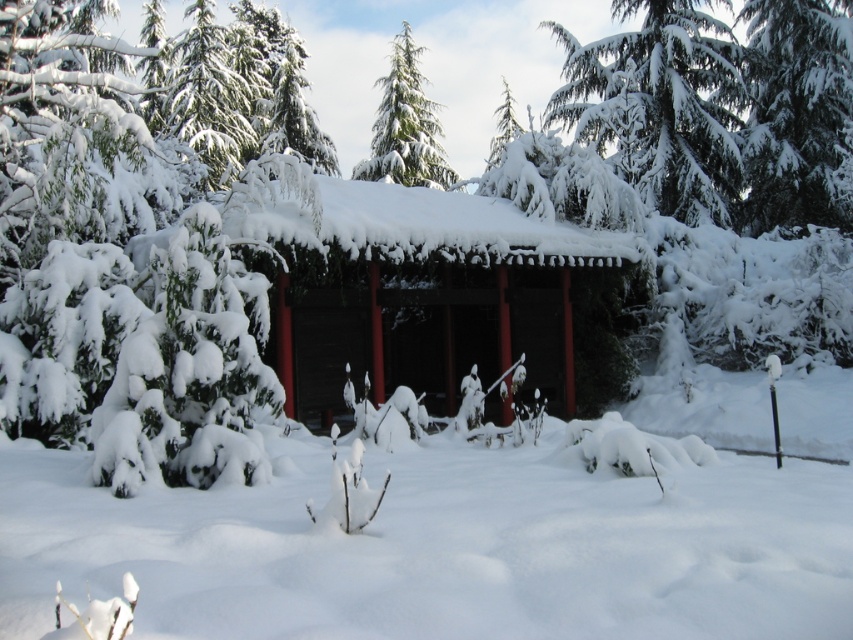
You are standing at the entrance of the pavilion and want to walk towards the point marked at coordinates point [526,568]. However, there is an obstacle at point [563,288]. Based on the spatial relationship between these two points, will you encounter the obstacle before reaching your destination?

Point [526,568] is in front of point [563,288], so you will reach your destination before encountering the obstacle.

You are standing at the edge of the snowy landscape and want to walk towards the smooth wooden cabin at center. Which direction should you look to see the white fluffy snow at center first?

The white fluffy snow at center is below the smooth wooden cabin at center, so you should look downward to see the white fluffy snow at center first as you approach the cabin.

Based on the coordinates provided, what is located at point (442, 547) in the winter scene?

The point at (442, 547) corresponds to white fluffy snow at center.